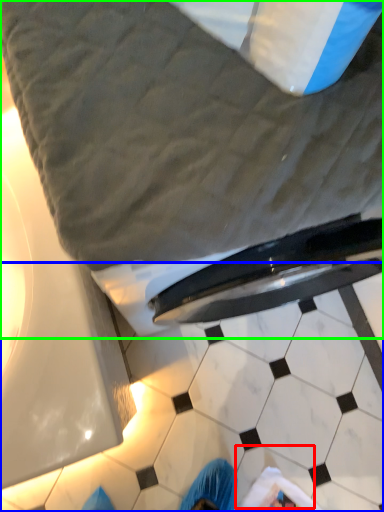
Question: Which object is the farthest from tile (highlighted by a red box)? Choose among these: tile (highlighted by a blue box) or bed (highlighted by a green box).

Choices:
 (A) tile
 (B) bed

Answer: (B)